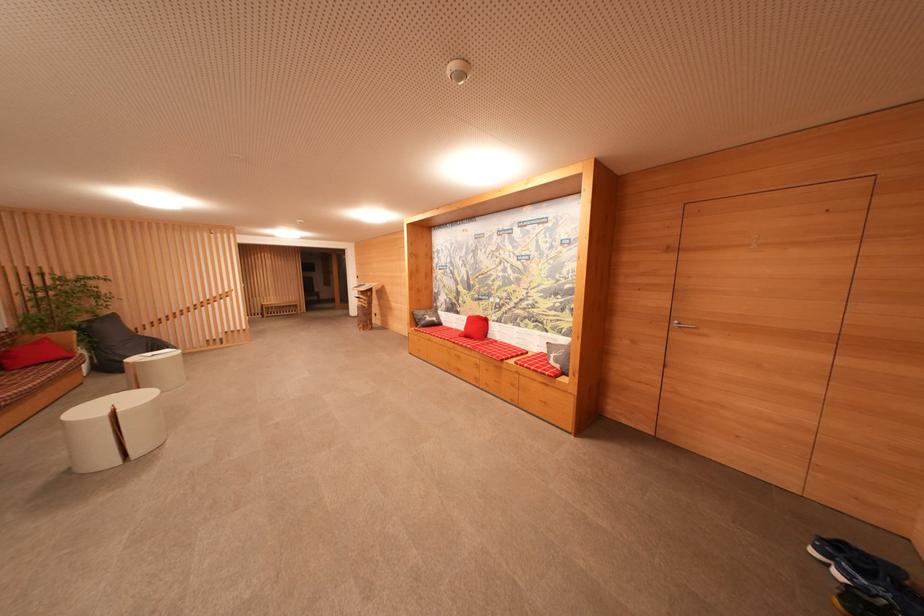
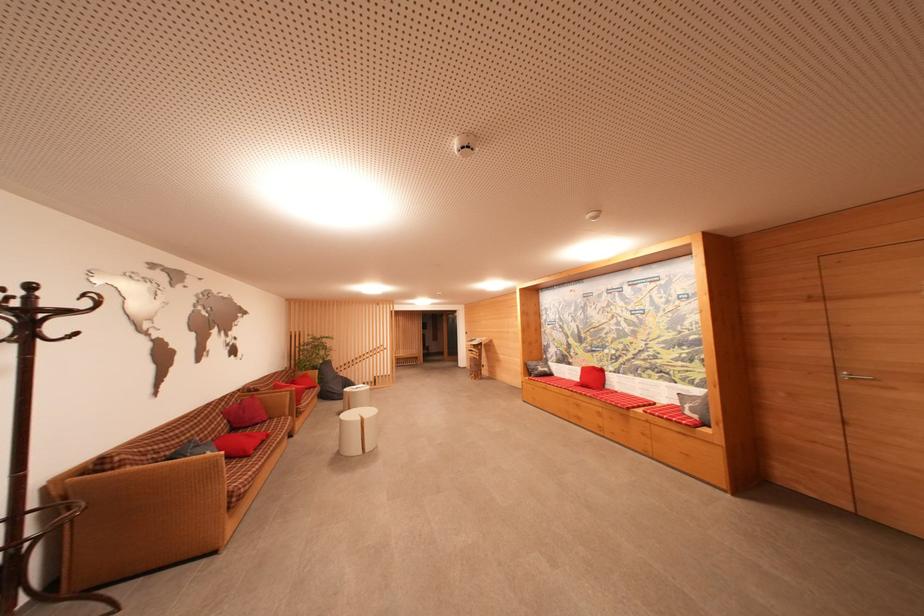
Locate, in the second image, the point that corresponds to the point at 482,321 in the first image.

(598, 371)